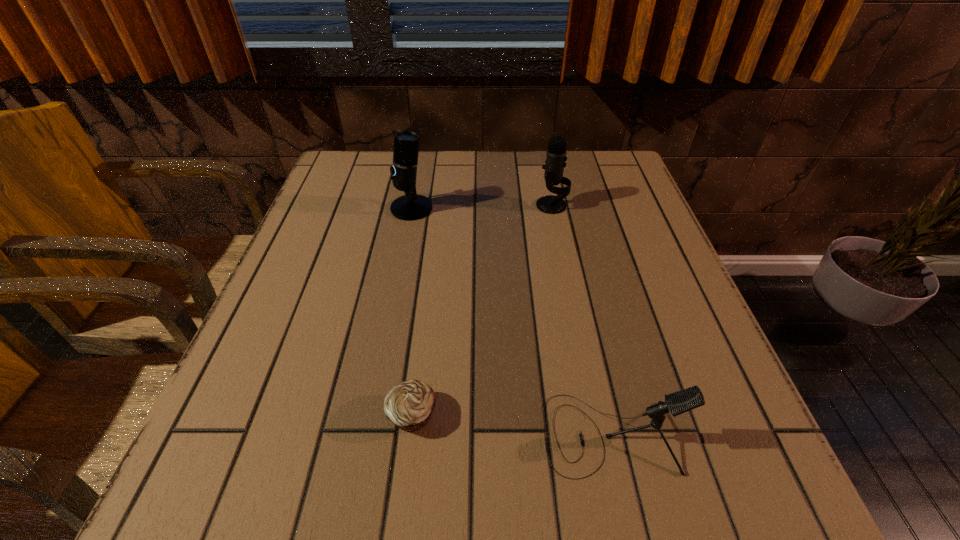
The height and width of the screenshot is (540, 960). Identify the location of object that is at the right edge. [679, 402].

This screenshot has height=540, width=960. I want to click on object that is positioned at the near right corner, so click(x=679, y=402).

The width and height of the screenshot is (960, 540). In order to click on vacant space at the far edge of the desktop in this screenshot , I will do `click(501, 191)`.

Image resolution: width=960 pixels, height=540 pixels. I want to click on free space at the left edge of the desktop, so click(x=233, y=447).

This screenshot has width=960, height=540. What are the coordinates of `free space at the right edge of the desktop` in the screenshot? It's located at [x=704, y=447].

At what (x,y) coordinates should I click in order to perform the action: click on vacant area at the far left corner. Please return your answer as a coordinate pair (x, y). The image size is (960, 540). Looking at the image, I should click on (323, 187).

Locate an element on the screen. The height and width of the screenshot is (540, 960). vacant area at the near left corner of the desktop is located at coordinates (243, 500).

Where is `free spot between the shortest microphone and the muffin`? The image size is (960, 540). free spot between the shortest microphone and the muffin is located at coordinates 512,424.

Identify the location of vacant space in between the leftmost microphone and the muffin. (412, 312).

Locate an element on the screen. This screenshot has height=540, width=960. vacant region between the third tallest object and the leftmost microphone is located at coordinates (511, 321).